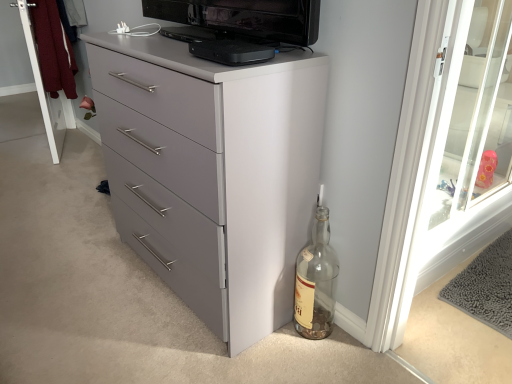
This screenshot has width=512, height=384. Find the location of `free spot below white wood screen door at upper left, which is counted as the second screen door, starting from the right (from a real-world perspective)`. free spot below white wood screen door at upper left, which is counted as the second screen door, starting from the right (from a real-world perspective) is located at coordinates (61, 145).